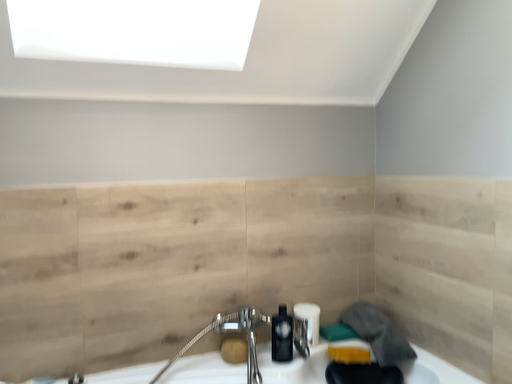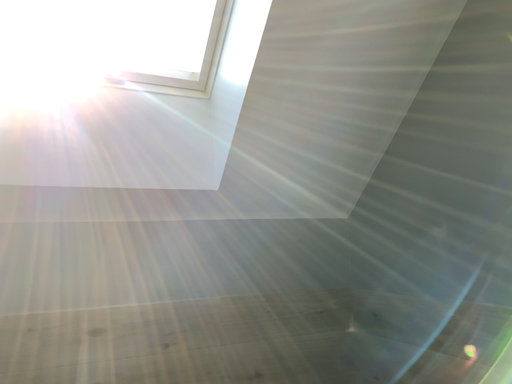
Question: Which way did the camera rotate in the video?

Choices:
 (A) rotated upward
 (B) rotated downward

Answer: (A)